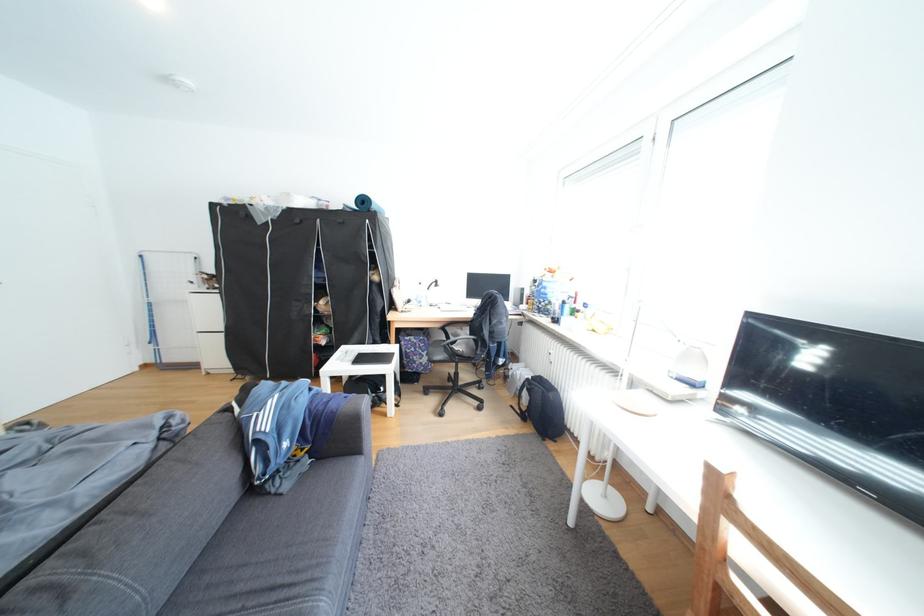
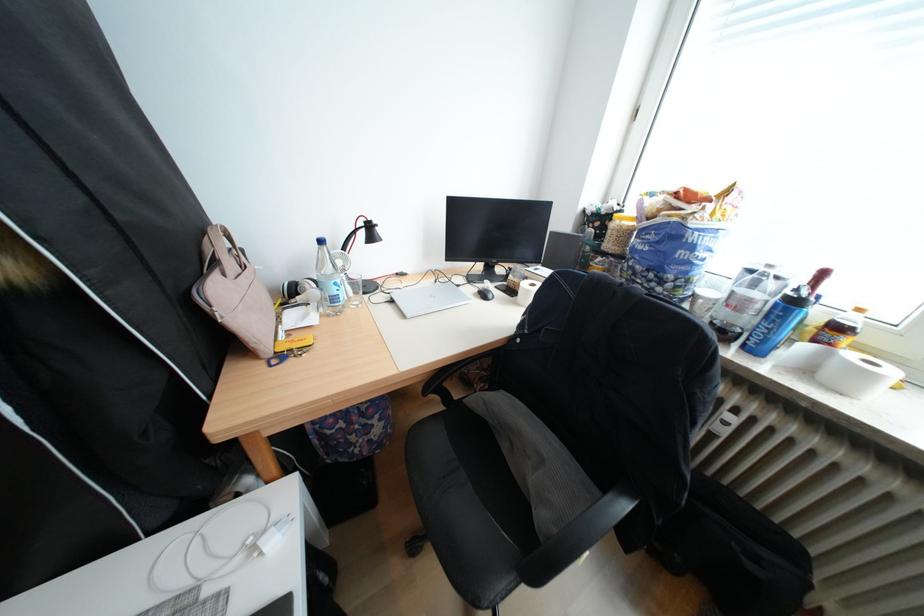
The point at (432, 302) is marked in the first image. Where is the corresponding point in the second image?

(346, 300)